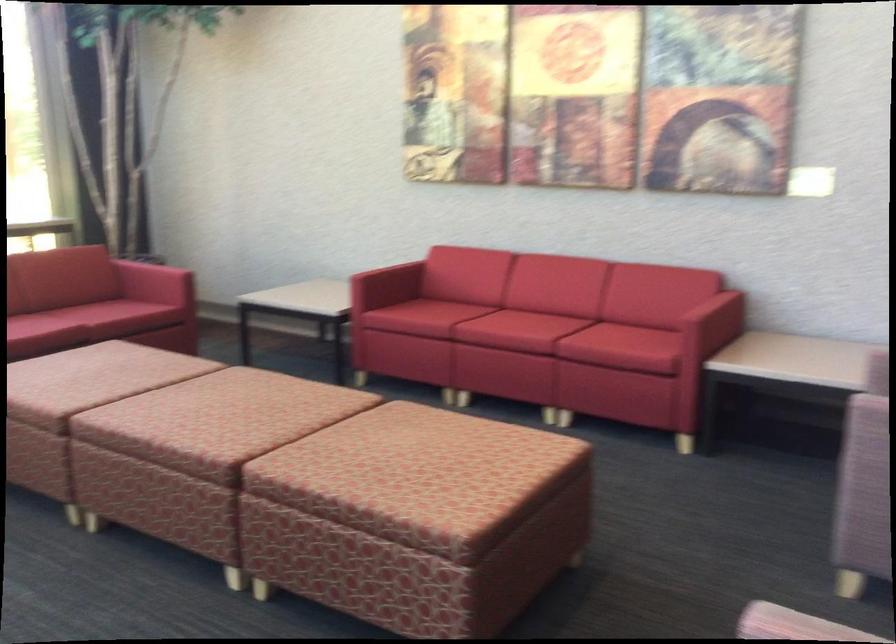
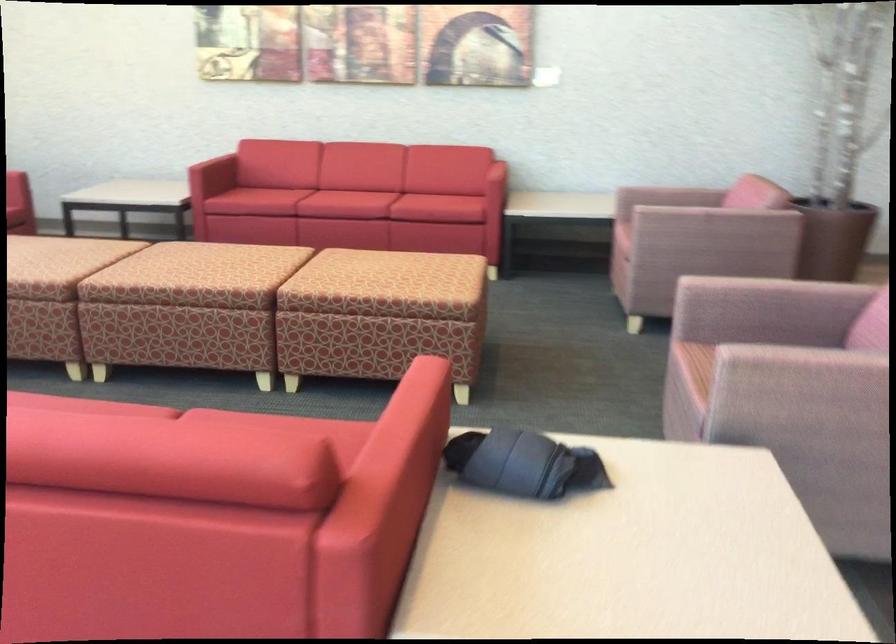
Find the pixel in the second image that matches point 684,327 in the first image.

(490, 173)